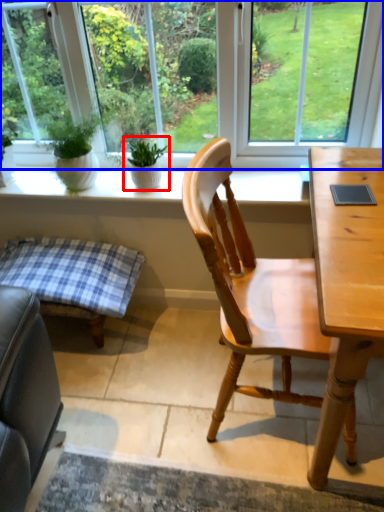
Question: Which object appears farthest to the camera in this image, houseplant (highlighted by a red box) or window (highlighted by a blue box)?

Choices:
 (A) houseplant
 (B) window

Answer: (A)